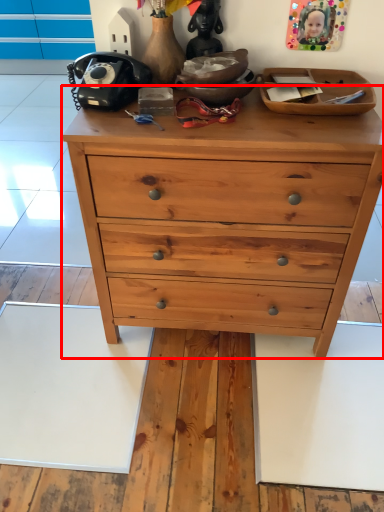
Question: From the image's perspective, what is the correct spatial relationship of chest of drawers (annotated by the red box) in relation to toy?

Choices:
 (A) above
 (B) below

Answer: (B)